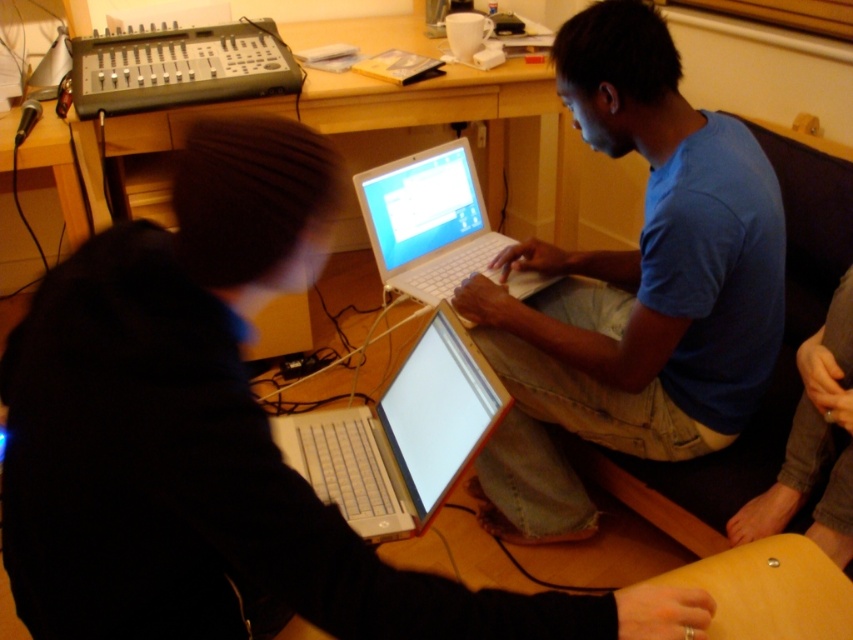
Question: Which point is farther from the camera taking this photo?

Choices:
 (A) (834, 396)
 (B) (421, 182)
 (C) (164, 90)
 (D) (643, 300)

Answer: (B)

Question: Is the position of blue cotton shirt at upper right less distant than that of dark gray fabric pants at lower right?

Choices:
 (A) yes
 (B) no

Answer: (B)

Question: Is blue cotton shirt at upper right to the right of silver metallic laptop at center from the viewer's perspective?

Choices:
 (A) no
 (B) yes

Answer: (B)

Question: Which of these objects is positioned farthest from the dark gray fabric pants at lower right?

Choices:
 (A) black plastic audio mixer at upper left
 (B) white plastic laptop at center
 (C) blue cotton shirt at upper right
 (D) silver metallic laptop at center

Answer: (A)

Question: Can you confirm if blue cotton shirt at upper right is smaller than dark gray fabric pants at lower right?

Choices:
 (A) no
 (B) yes

Answer: (A)

Question: Which is nearer to the white plastic laptop at center?

Choices:
 (A) blue cotton shirt at upper right
 (B) silver metallic laptop at center

Answer: (A)